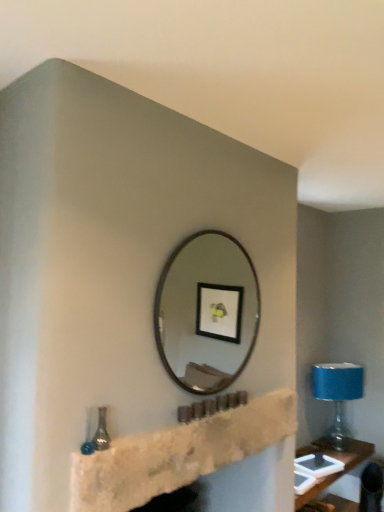
Image resolution: width=384 pixels, height=512 pixels. I want to click on blue fabric lampshade at right, so click(x=337, y=394).

Locate an element on the screen. This screenshot has height=512, width=384. blue fabric lampshade at right is located at coordinates (337, 394).

Based on the photo, who is bigger, blue fabric lampshade at right or metallic silver mirror at center?

Bigger between the two is blue fabric lampshade at right.

Is there a large distance between blue fabric lampshade at right and metallic silver mirror at center?

Yes, blue fabric lampshade at right and metallic silver mirror at center are quite far apart.

Is blue fabric lampshade at right looking in the opposite direction of metallic silver mirror at center?

No, blue fabric lampshade at right is not facing away from metallic silver mirror at center.

From a real-world perspective, who is located lower, blue fabric lampshade at right or metallic silver mirror at center?

blue fabric lampshade at right.

From their relative heights in the image, would you say metallic silver mirror at center is taller or shorter than blue fabric lampshade at right?

Considering their sizes, metallic silver mirror at center has more height than blue fabric lampshade at right.

Can you confirm if metallic silver mirror at center is smaller than blue fabric lampshade at right?

Yes, metallic silver mirror at center is smaller than blue fabric lampshade at right.

Consider the image. Is metallic silver mirror at center located outside blue fabric lampshade at right?

That's correct, metallic silver mirror at center is outside of blue fabric lampshade at right.

Measure the distance between metallic silver mirror at center and blue fabric lampshade at right.

metallic silver mirror at center is 4.38 feet away from blue fabric lampshade at right.

Between metallic silver mirror at center and stone fireplace at center, which one has larger size?

Bigger between the two is metallic silver mirror at center.

Is metallic silver mirror at center next to stone fireplace at center?

No.

How many degrees apart are the facing directions of metallic silver mirror at center and stone fireplace at center?

Answer: The angular difference between metallic silver mirror at center and stone fireplace at center is 0.0108 degrees.

Which point is more forward, (x=216, y=271) or (x=245, y=414)?

The point (x=245, y=414) is more forward.

From a real-world perspective, is blue fabric lampshade at right physically above stone fireplace at center?

Incorrect, from a real-world perspective, blue fabric lampshade at right is lower than stone fireplace at center.

Is the depth of blue fabric lampshade at right greater than that of stone fireplace at center?

Yes, it is.

Is blue fabric lampshade at right touching stone fireplace at center?

No, blue fabric lampshade at right is not touching stone fireplace at center.

This screenshot has height=512, width=384. I want to click on shelf above the blue fabric lampshade at right (from the image's perspective), so click(x=178, y=454).

From a real-world perspective, is stone fireplace at center physically above blue fabric lampshade at right?

Indeed, from a real-world perspective, stone fireplace at center stands above blue fabric lampshade at right.

Are stone fireplace at center and blue fabric lampshade at right making contact?

No, stone fireplace at center is not next to blue fabric lampshade at right.

Does point (175, 441) come farther from viewer compared to point (361, 390)?

No, it is not.

In terms of width, does stone fireplace at center look wider or thinner when compared to metallic silver mirror at center?

Clearly, stone fireplace at center has less width compared to metallic silver mirror at center.

Considering the sizes of objects stone fireplace at center and metallic silver mirror at center in the image provided, who is shorter, stone fireplace at center or metallic silver mirror at center?

With less height is stone fireplace at center.

What's the angular difference between stone fireplace at center and metallic silver mirror at center's facing directions?

0.0108 degrees separate the facing orientations of stone fireplace at center and metallic silver mirror at center.

Which is behind, stone fireplace at center or metallic silver mirror at center?

metallic silver mirror at center.

Locate an element on the screen. The image size is (384, 512). table lamp below the metallic silver mirror at center (from the image's perspective) is located at coordinates (337, 394).

This screenshot has height=512, width=384. Identify the location of table lamp that appears behind the metallic silver mirror at center. (337, 394).

Which object lies further to the anchor point stone fireplace at center, metallic silver mirror at center or blue fabric lampshade at right?

The object further to stone fireplace at center is metallic silver mirror at center.

When comparing their distances from blue fabric lampshade at right, does metallic silver mirror at center or stone fireplace at center seem closer?

metallic silver mirror at center.

Looking at the image, which one is located further to metallic silver mirror at center, blue fabric lampshade at right or stone fireplace at center?

stone fireplace at center lies further to metallic silver mirror at center than the other object.

Which object lies nearer to the anchor point metallic silver mirror at center, stone fireplace at center or blue fabric lampshade at right?

blue fabric lampshade at right is closer to metallic silver mirror at center.

Looking at the image, which one is located closer to stone fireplace at center, blue fabric lampshade at right or metallic silver mirror at center?

blue fabric lampshade at right is positioned closer to the anchor stone fireplace at center.

Considering their positions, is stone fireplace at center positioned closer to blue fabric lampshade at right than metallic silver mirror at center?

metallic silver mirror at center is closer to blue fabric lampshade at right.

Where is `mirror between stone fireplace at center and blue fabric lampshade at right in the front-back direction`? This screenshot has height=512, width=384. mirror between stone fireplace at center and blue fabric lampshade at right in the front-back direction is located at coordinates (207, 312).